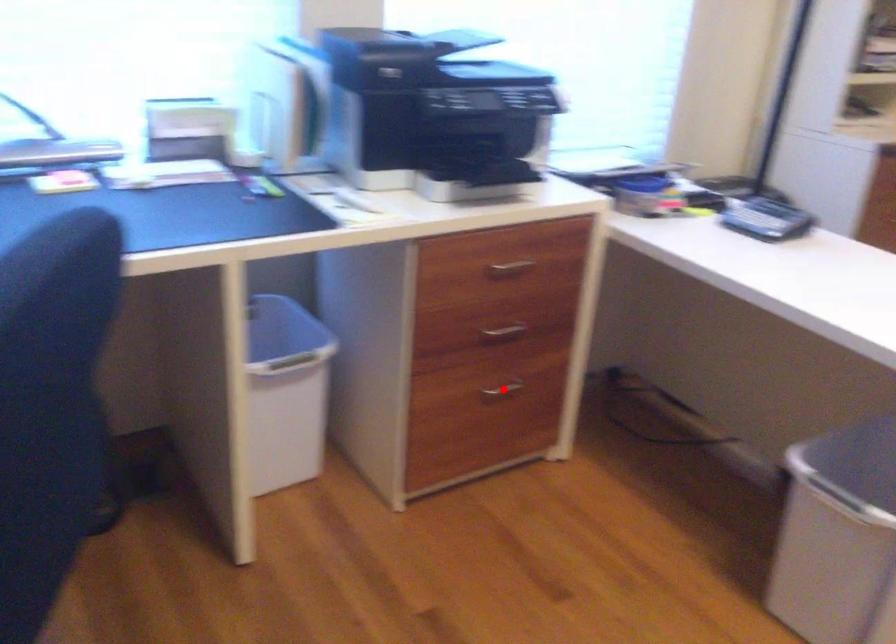
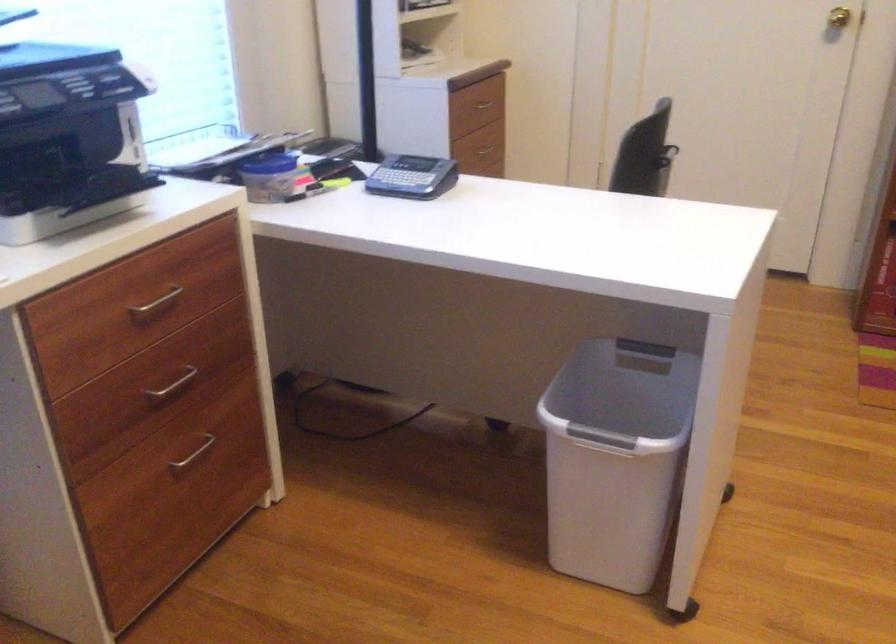
Find the pixel in the second image that matches the highlighted location in the first image.

(193, 453)